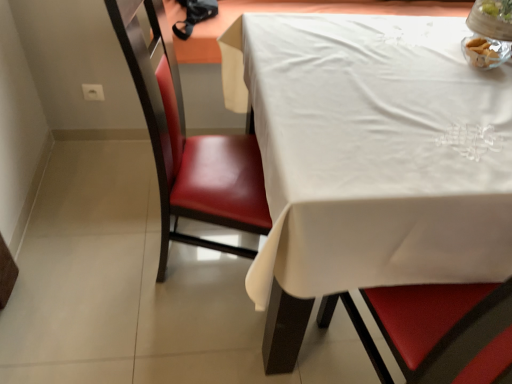
Question: Could you tell me if clear glass bowl at upper right is turned towards white cloth at upper right?

Choices:
 (A) no
 (B) yes

Answer: (A)

Question: Does clear glass bowl at upper right have a lesser height compared to white cloth at upper right?

Choices:
 (A) yes
 (B) no

Answer: (A)

Question: From a real-world perspective, is clear glass bowl at upper right physically above white cloth at upper right?

Choices:
 (A) yes
 (B) no

Answer: (A)

Question: Is clear glass bowl at upper right placed right next to white cloth at upper right?

Choices:
 (A) yes
 (B) no

Answer: (B)

Question: Is clear glass bowl at upper right bigger than white cloth at upper right?

Choices:
 (A) yes
 (B) no

Answer: (B)

Question: From the image's perspective, is clear glass bowl at upper right located above or below leather at left?

Choices:
 (A) below
 (B) above

Answer: (B)

Question: Considering the positions of clear glass bowl at upper right and leather at left in the image, is clear glass bowl at upper right taller or shorter than leather at left?

Choices:
 (A) tall
 (B) short

Answer: (B)

Question: Considering their positions, is clear glass bowl at upper right located in front of or behind leather at left?

Choices:
 (A) behind
 (B) front

Answer: (A)

Question: Is clear glass bowl at upper right spatially inside leather at left, or outside of it?

Choices:
 (A) inside
 (B) outside

Answer: (B)

Question: From a real-world perspective, is clear glass bowl at upper right physically located above or below white cloth at upper right?

Choices:
 (A) below
 (B) above

Answer: (B)

Question: Is point (481, 3) closer or farther from the camera than point (425, 86)?

Choices:
 (A) closer
 (B) farther

Answer: (B)

Question: Considering the positions of clear glass bowl at upper right and white cloth at upper right in the image, is clear glass bowl at upper right bigger or smaller than white cloth at upper right?

Choices:
 (A) small
 (B) big

Answer: (A)

Question: Based on their positions, is clear glass bowl at upper right located to the left or right of white cloth at upper right?

Choices:
 (A) left
 (B) right

Answer: (B)

Question: Visually, is white cloth at upper right positioned to the left or to the right of leather at left?

Choices:
 (A) left
 (B) right

Answer: (B)

Question: Is white cloth at upper right taller or shorter than leather at left?

Choices:
 (A) short
 (B) tall

Answer: (A)